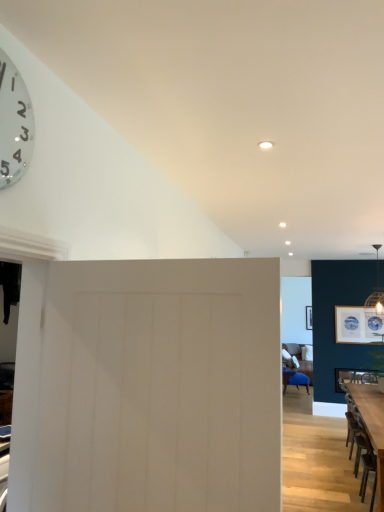
Question: Considering the relative sizes of wooden table at lower right and metallic silver clock at upper left in the image provided, is wooden table at lower right wider than metallic silver clock at upper left?

Choices:
 (A) yes
 (B) no

Answer: (A)

Question: Does wooden table at lower right contain metallic silver clock at upper left?

Choices:
 (A) yes
 (B) no

Answer: (B)

Question: Would you say wooden table at lower right is a long distance from metallic silver clock at upper left?

Choices:
 (A) no
 (B) yes

Answer: (B)

Question: Considering the relative positions of wooden table at lower right and metallic silver clock at upper left in the image provided, is wooden table at lower right in front of metallic silver clock at upper left?

Choices:
 (A) no
 (B) yes

Answer: (A)

Question: From the image's perspective, is wooden table at lower right on top of metallic silver clock at upper left?

Choices:
 (A) yes
 (B) no

Answer: (B)

Question: From the image's perspective, is wooden table at lower right positioned above or below metallic silver clock at upper left?

Choices:
 (A) above
 (B) below

Answer: (B)

Question: Does point (365, 402) appear closer or farther from the camera than point (19, 140)?

Choices:
 (A) closer
 (B) farther

Answer: (B)

Question: From their relative heights in the image, would you say wooden table at lower right is taller or shorter than metallic silver clock at upper left?

Choices:
 (A) tall
 (B) short

Answer: (A)

Question: Considering the positions of wooden table at lower right and metallic silver clock at upper left in the image, is wooden table at lower right wider or thinner than metallic silver clock at upper left?

Choices:
 (A) thin
 (B) wide

Answer: (B)

Question: Considering the positions of matte white picture frame at upper right and metallic silver clock at upper left in the image, is matte white picture frame at upper right taller or shorter than metallic silver clock at upper left?

Choices:
 (A) tall
 (B) short

Answer: (A)

Question: Considering the positions of matte white picture frame at upper right and metallic silver clock at upper left in the image, is matte white picture frame at upper right wider or thinner than metallic silver clock at upper left?

Choices:
 (A) wide
 (B) thin

Answer: (A)

Question: Is point (357, 315) closer or farther from the camera than point (16, 103)?

Choices:
 (A) farther
 (B) closer

Answer: (A)

Question: Relative to metallic silver clock at upper left, is matte white picture frame at upper right in front or behind?

Choices:
 (A) front
 (B) behind

Answer: (B)

Question: In the image, is matte white picture frame at upper right positioned in front of or behind white matte door at center?

Choices:
 (A) front
 (B) behind

Answer: (B)

Question: Looking at their shapes, would you say matte white picture frame at upper right is wider or thinner than white matte door at center?

Choices:
 (A) wide
 (B) thin

Answer: (B)